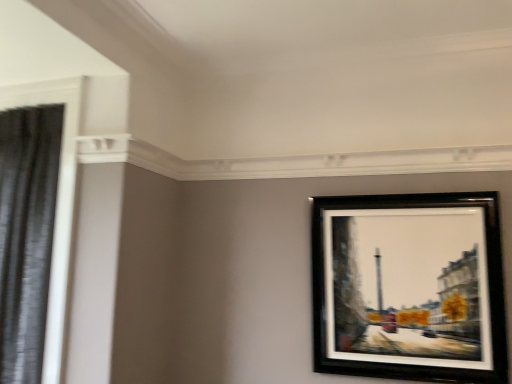
Question: In terms of width, does black glossy picture frame at upper right look wider or thinner when compared to black fabric shower curtain at left?

Choices:
 (A) wide
 (B) thin

Answer: (B)

Question: Considering the positions of black glossy picture frame at upper right and black fabric shower curtain at left in the image, is black glossy picture frame at upper right bigger or smaller than black fabric shower curtain at left?

Choices:
 (A) small
 (B) big

Answer: (A)

Question: Considering their positions, is black glossy picture frame at upper right located in front of or behind black fabric shower curtain at left?

Choices:
 (A) behind
 (B) front

Answer: (A)

Question: In terms of height, does black fabric shower curtain at left look taller or shorter compared to black glossy picture frame at upper right?

Choices:
 (A) short
 (B) tall

Answer: (B)

Question: Visually, is black fabric shower curtain at left positioned to the left or to the right of black glossy picture frame at upper right?

Choices:
 (A) right
 (B) left

Answer: (B)

Question: Considering the positions of black fabric shower curtain at left and black glossy picture frame at upper right in the image, is black fabric shower curtain at left bigger or smaller than black glossy picture frame at upper right?

Choices:
 (A) big
 (B) small

Answer: (A)

Question: Considering the positions of black fabric shower curtain at left and black glossy picture frame at upper right in the image, is black fabric shower curtain at left wider or thinner than black glossy picture frame at upper right?

Choices:
 (A) thin
 (B) wide

Answer: (B)